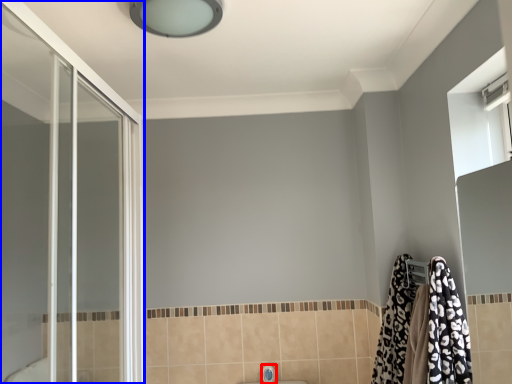
Question: Which object is further to the camera taking this photo, faucet (highlighted by a red box) or screen door (highlighted by a blue box)?

Choices:
 (A) faucet
 (B) screen door

Answer: (A)